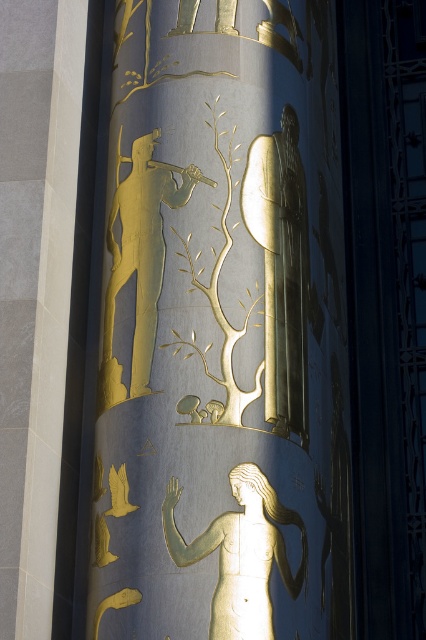
Question: Which object appears farthest from the camera in this image?

Choices:
 (A) gold metallic relief at center
 (B) gold metallic figure at center

Answer: (B)

Question: Is gold metallic relief at center smaller than gold metallic figure at center?

Choices:
 (A) no
 (B) yes

Answer: (A)

Question: Is gold metallic relief at center thinner than gold metallic figure at center?

Choices:
 (A) yes
 (B) no

Answer: (B)

Question: Which point is closer to the camera taking this photo?

Choices:
 (A) (235, 579)
 (B) (242, 497)

Answer: (A)

Question: Does gold metallic relief at center appear under gold metallic figure at center?

Choices:
 (A) yes
 (B) no

Answer: (B)